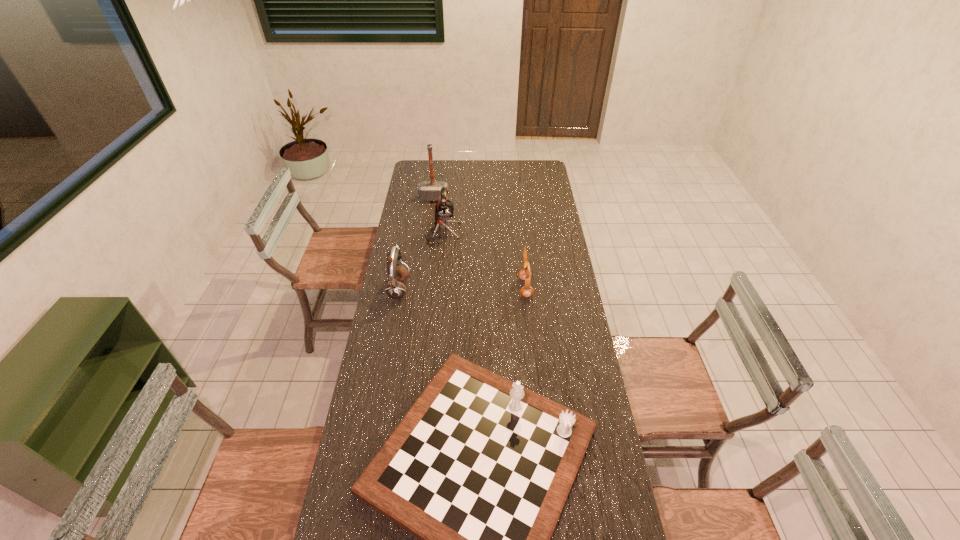
Where is `free space that is in between the fourth nearest object and the shortest earphone`? This screenshot has width=960, height=540. free space that is in between the fourth nearest object and the shortest earphone is located at coordinates (484, 260).

Locate an element on the screen. This screenshot has width=960, height=540. vacant area that lies between the leftmost earphone and the shortest earphone is located at coordinates (462, 288).

Point out which object is positioned as the nearest to the nearest object. Please provide its 2D coordinates. Your answer should be formatted as a tuple, i.e. [(x, y)], where the tuple contains the x and y coordinates of a point satisfying the conditions above.

[(395, 289)]

Locate which object ranks fourth in proximity to the leftmost earphone. Please provide its 2D coordinates. Your answer should be formatted as a tuple, i.e. [(x, y)], where the tuple contains the x and y coordinates of a point satisfying the conditions above.

[(428, 190)]

The height and width of the screenshot is (540, 960). In order to click on earphone that is the closest one to the second farthest object in this screenshot , I will do `click(395, 289)`.

Locate an element on the screen. earphone that is the nearest to the leftmost earphone is located at coordinates (444, 210).

Identify the location of blank area in the image that satisfies the following two spatial constraints: 1. on the striking surface of the hammer; 2. on the ear pads of the leftmost earphone. The width and height of the screenshot is (960, 540). (421, 289).

This screenshot has height=540, width=960. Find the location of `free space that satisfies the following two spatial constraints: 1. on the striking surface of the fourth nearest object; 2. on the left side of the farthest object`. free space that satisfies the following two spatial constraints: 1. on the striking surface of the fourth nearest object; 2. on the left side of the farthest object is located at coordinates (429, 233).

Locate an element on the screen. Image resolution: width=960 pixels, height=540 pixels. vacant space that satisfies the following two spatial constraints: 1. on the front side of the second earphone from left to right; 2. on the ear pads of the leftmost earphone is located at coordinates (437, 289).